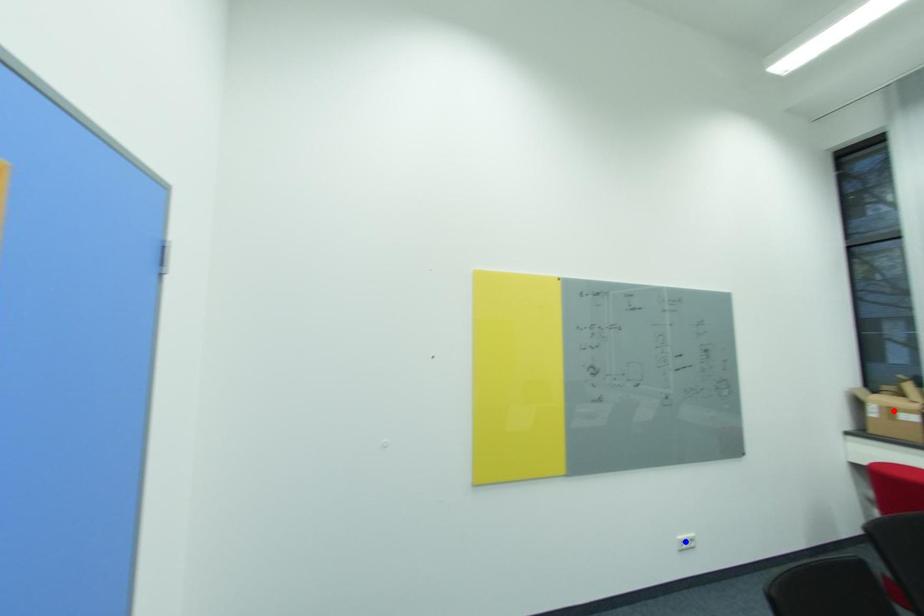
Question: In the image, two points are highlighted. Which point is nearer to the camera? Reply with the corresponding letter.

Choices:
 (A) blue point
 (B) red point

Answer: (B)